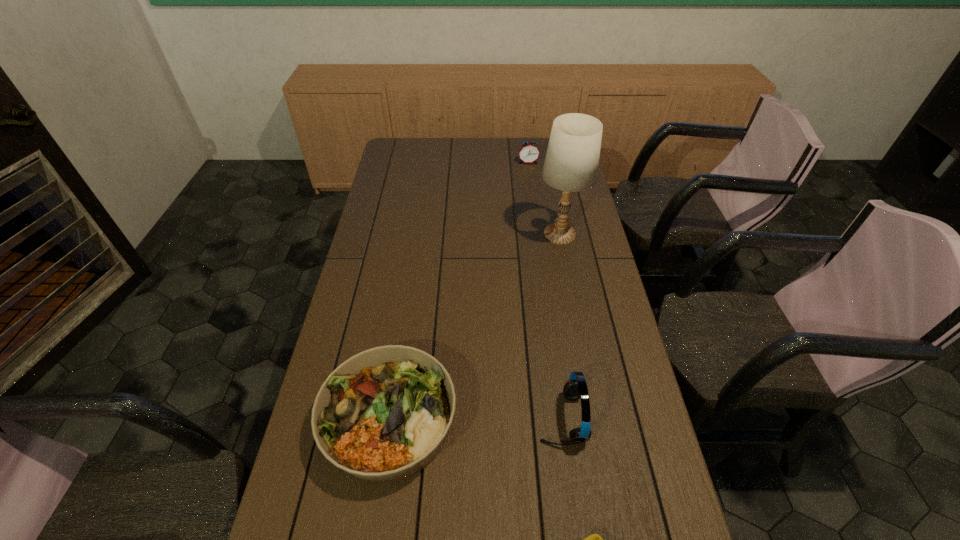
This screenshot has width=960, height=540. What are the coordinates of `lamp` in the screenshot? It's located at (571, 164).

Where is `the tallest object`? This screenshot has height=540, width=960. the tallest object is located at coordinates (571, 164).

Where is `the second tallest object`? the second tallest object is located at coordinates (575, 388).

This screenshot has width=960, height=540. What are the coordinates of `alarm clock` in the screenshot? It's located at (529, 152).

The image size is (960, 540). What are the coordinates of `salad plate` in the screenshot? It's located at (384, 414).

The height and width of the screenshot is (540, 960). Find the location of `vacant region located on the left of the lamp`. vacant region located on the left of the lamp is located at coordinates (500, 234).

Identify the location of free spot located with the microphone attached to the side of the headset. This screenshot has width=960, height=540. (414, 418).

Where is `vacant space situated 0.350m with the microphone attached to the side of the headset`? vacant space situated 0.350m with the microphone attached to the side of the headset is located at coordinates (402, 418).

Where is `vacant area situated 0.090m with the microphone attached to the side of the headset`? vacant area situated 0.090m with the microphone attached to the side of the headset is located at coordinates (503, 418).

Where is `free region located 0.050m on the clock face of the farthest object`? This screenshot has height=540, width=960. free region located 0.050m on the clock face of the farthest object is located at coordinates (529, 171).